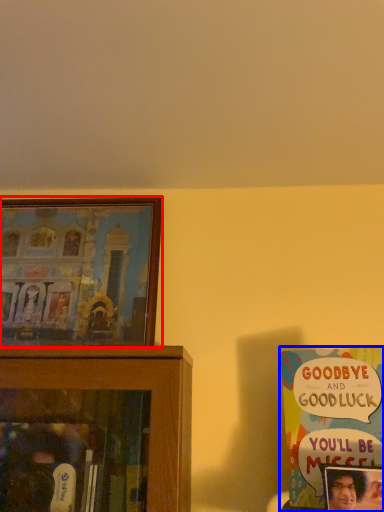
Question: Among these objects, which one is farthest to the camera, picture frame (highlighted by a red box) or book (highlighted by a blue box)?

Choices:
 (A) picture frame
 (B) book

Answer: (A)